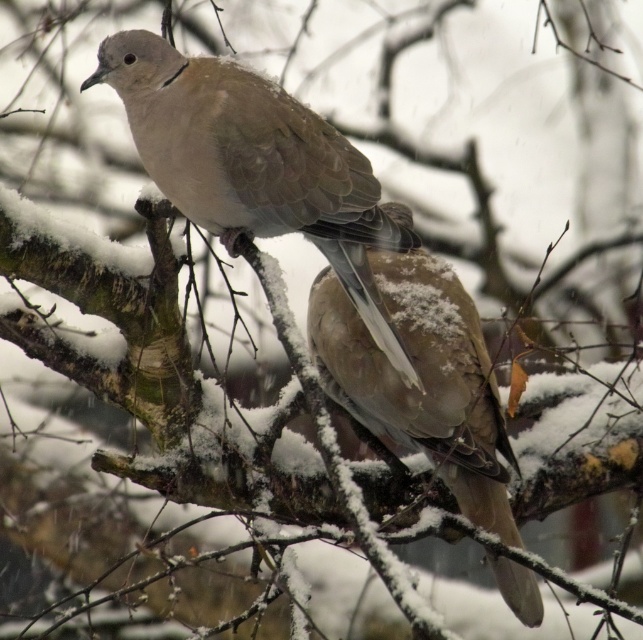
You are an ornithologist analyzing the image. You need to locate the matte brown dove at center precisely. What are its coordinates in the image?

The matte brown dove at center is located at coordinates (255, 164).

You are a birdwatcher observing two birds on a snow branch. You notice the matte brown dove at center and the fuzzy brown pigeon at center. Which one has a bigger body size?

The matte brown dove at center has a larger size compared to the fuzzy brown pigeon at center.